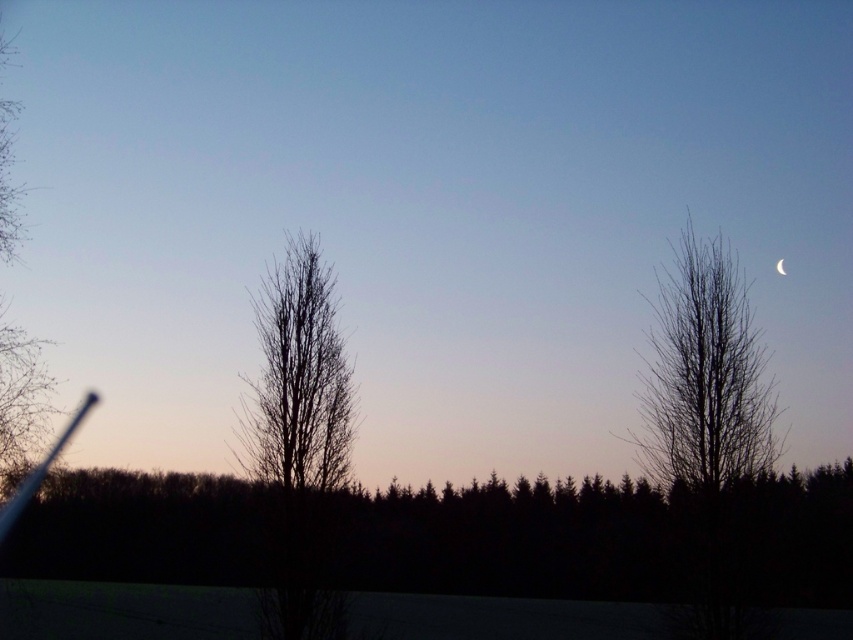
You are an astronomer observing the twilight scene. You notice the bare branches at right and the silvery metallic crescent at upper center. Which object appears to the left of the other?

The bare branches at right is positioned on the left side of silvery metallic crescent at upper center, so the bare branches at right appears to the left of the silvery metallic crescent at upper center.

You are an astronomer observing the twilight scene. You notice the silhouette bare tree at left and the silvery metallic crescent at upper center. Which object appears taller in the image?

The silhouette bare tree at left appears taller than the silvery metallic crescent at upper center in the image.